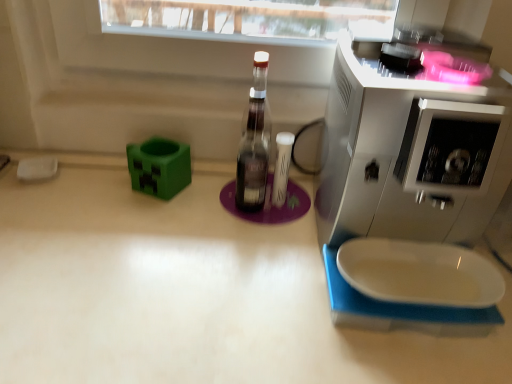
Question: In the image, is white matte countertop at center positioned in front of or behind white glossy coffee machine at upper right?

Choices:
 (A) front
 (B) behind

Answer: (B)

Question: Looking at the image, does white matte countertop at center seem bigger or smaller compared to white glossy coffee machine at upper right?

Choices:
 (A) small
 (B) big

Answer: (B)

Question: From a real-world perspective, is white matte countertop at center above or below white glossy coffee machine at upper right?

Choices:
 (A) below
 (B) above

Answer: (A)

Question: In the image, is white glossy coffee machine at upper right positioned in front of or behind white matte countertop at center?

Choices:
 (A) front
 (B) behind

Answer: (A)

Question: Visually, is white glossy coffee machine at upper right positioned to the left or to the right of white matte countertop at center?

Choices:
 (A) right
 (B) left

Answer: (A)

Question: From a real-world perspective, is white glossy coffee machine at upper right positioned above or below white matte countertop at center?

Choices:
 (A) below
 (B) above

Answer: (B)

Question: From the image's perspective, is white glossy coffee machine at upper right located above or below white matte countertop at center?

Choices:
 (A) below
 (B) above

Answer: (B)